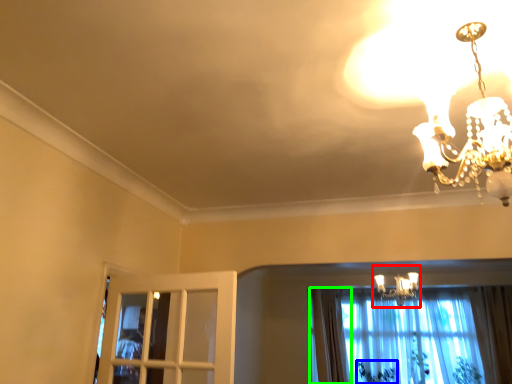
Question: Which object is the farthest from lamp (highlighted by a red box)? Choose among these: plant (highlighted by a blue box) or curtain (highlighted by a green box).

Choices:
 (A) plant
 (B) curtain

Answer: (A)